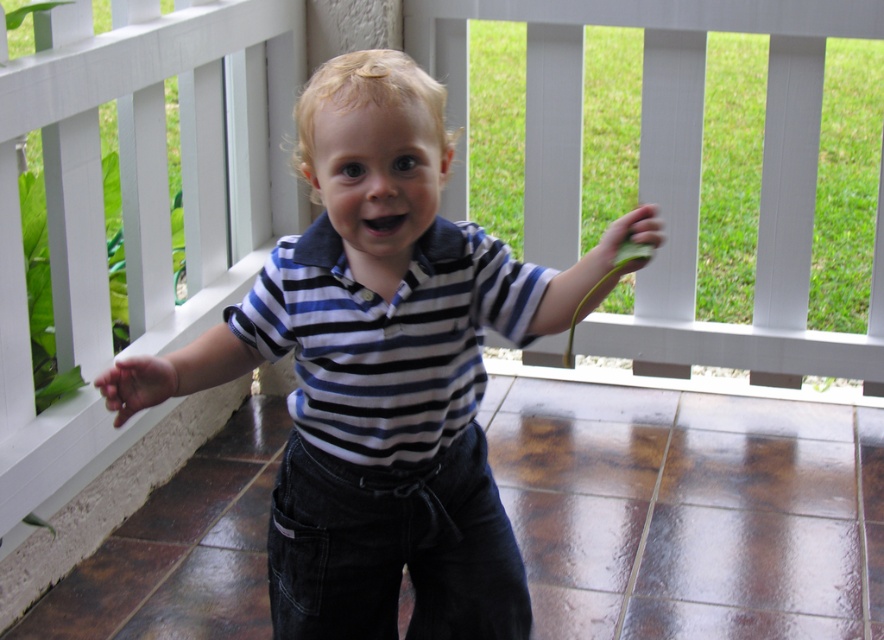
Question: Which point is farther to the camera?

Choices:
 (A) (484, 440)
 (B) (629, 264)
 (C) (135, 372)

Answer: (A)

Question: Considering the relative positions of striped cotton shirt at center and matte skin hand at lower left in the image provided, where is striped cotton shirt at center located with respect to matte skin hand at lower left?

Choices:
 (A) above
 (B) below

Answer: (B)

Question: Is striped cotton shirt at center to the right of green leafy hand at right from the viewer's perspective?

Choices:
 (A) no
 (B) yes

Answer: (A)

Question: Which object is closer to the camera taking this photo?

Choices:
 (A) blue striped shirt at center
 (B) green leafy hand at right

Answer: (B)

Question: Is the position of matte skin hand at lower left more distant than that of green leafy hand at right?

Choices:
 (A) yes
 (B) no

Answer: (B)

Question: Which point appears farthest from the camera in this image?

Choices:
 (A) (131, 410)
 (B) (387, 120)

Answer: (B)